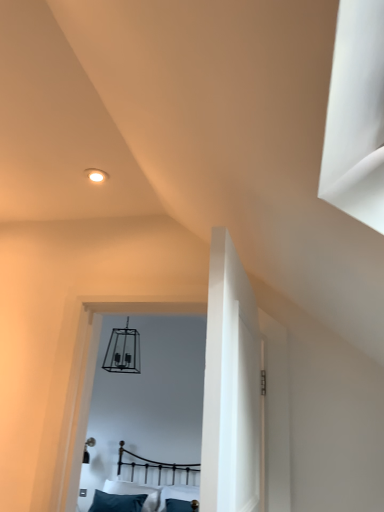
Question: Is metallic black bed at center spatially inside teal fabric pillow at lower center, or outside of it?

Choices:
 (A) outside
 (B) inside

Answer: (A)

Question: Considering the relative positions of metallic black bed at center and teal fabric pillow at lower center in the image provided, is metallic black bed at center to the left or to the right of teal fabric pillow at lower center?

Choices:
 (A) right
 (B) left

Answer: (A)

Question: Considering the positions of metallic black bed at center and teal fabric pillow at lower center in the image, is metallic black bed at center taller or shorter than teal fabric pillow at lower center?

Choices:
 (A) short
 (B) tall

Answer: (B)

Question: Based on their sizes in the image, would you say teal fabric pillow at lower center is bigger or smaller than metallic black bed at center?

Choices:
 (A) small
 (B) big

Answer: (A)

Question: In the image, is teal fabric pillow at lower center positioned in front of or behind metallic black bed at center?

Choices:
 (A) behind
 (B) front

Answer: (A)

Question: Would you say teal fabric pillow at lower center is inside or outside metallic black bed at center?

Choices:
 (A) inside
 (B) outside

Answer: (A)

Question: Visually, is teal fabric pillow at lower center positioned to the left or to the right of metallic black bed at center?

Choices:
 (A) right
 (B) left

Answer: (B)